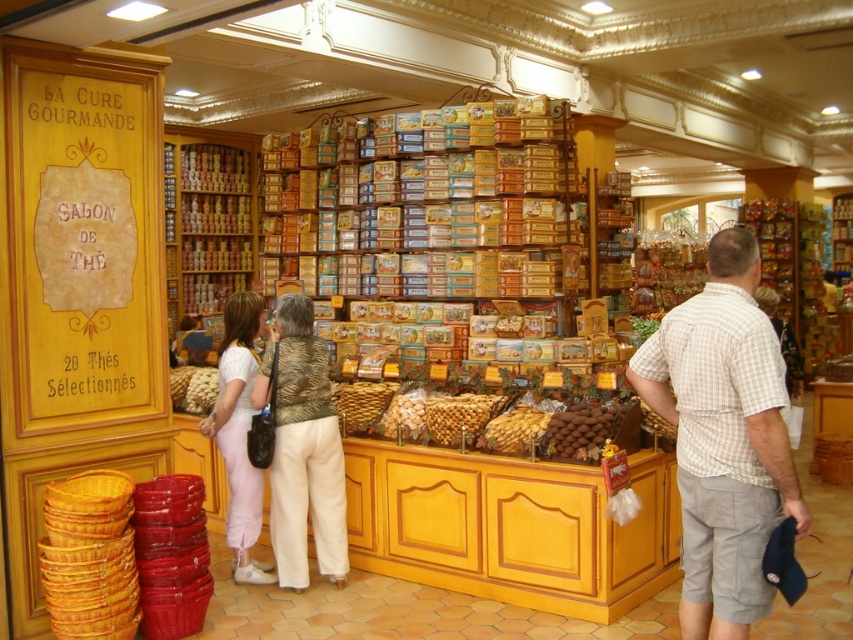
Between plaid cotton shirt at center and brown chocolate at center, which one is positioned lower?

Positioned lower is brown chocolate at center.

Does plaid cotton shirt at center have a greater width compared to brown chocolate at center?

Correct, the width of plaid cotton shirt at center exceeds that of brown chocolate at center.

This screenshot has width=853, height=640. Describe the element at coordinates (723, 438) in the screenshot. I see `plaid cotton shirt at center` at that location.

Find the location of a particular element. The width and height of the screenshot is (853, 640). plaid cotton shirt at center is located at coordinates (723, 438).

Does plaid cotton shirt at center appear on the left side of matte white pants at center?

Incorrect, plaid cotton shirt at center is not on the left side of matte white pants at center.

Can you confirm if plaid cotton shirt at center is thinner than matte white pants at center?

Indeed, plaid cotton shirt at center has a lesser width compared to matte white pants at center.

Does point (799, 504) come in front of point (300, 531)?

Yes.

Image resolution: width=853 pixels, height=640 pixels. I want to click on plaid cotton shirt at center, so click(x=723, y=438).

Can you confirm if matte white pants at center is positioned below brown chocolate at center?

Yes, matte white pants at center is below brown chocolate at center.

Is matte white pants at center shorter than brown chocolate at center?

In fact, matte white pants at center may be taller than brown chocolate at center.

Does point (306, 452) come behind point (602, 435)?

Yes, it is behind point (602, 435).

You are a GUI agent. You are given a task and a screenshot of the screen. Output one action in this format:
    pyautogui.click(x=<x>, y=<y>)
    Task: Click on the matte white pants at center
    This screenshot has width=853, height=640.
    Given the screenshot: What is the action you would take?
    pyautogui.click(x=296, y=444)